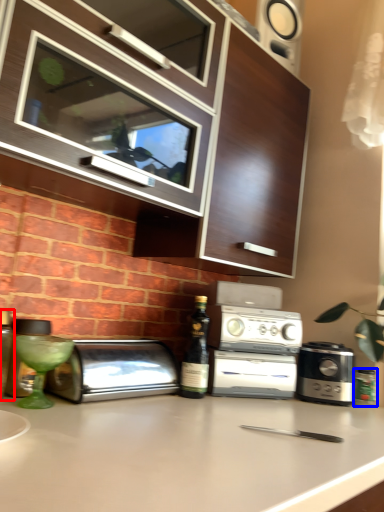
Question: Which point is further to the camera, bottle (highlighted by a red box) or bottle (highlighted by a blue box)?

Choices:
 (A) bottle
 (B) bottle

Answer: (B)